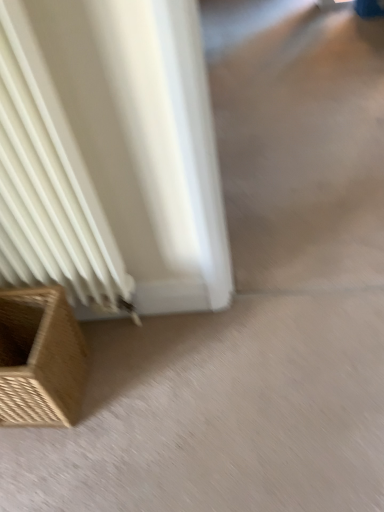
Question: Based on their positions, is brown woven basket at lower left located to the left or right of beige carpet at lower left?

Choices:
 (A) left
 (B) right

Answer: (A)

Question: Based on their sizes in the image, would you say brown woven basket at lower left is bigger or smaller than beige carpet at lower left?

Choices:
 (A) big
 (B) small

Answer: (A)

Question: From a real-world perspective, relative to beige carpet at lower left, is brown woven basket at lower left vertically above or below?

Choices:
 (A) above
 (B) below

Answer: (A)

Question: In the image, is beige carpet at lower left positioned in front of or behind brown woven basket at lower left?

Choices:
 (A) front
 (B) behind

Answer: (B)

Question: Is beige carpet at lower left bigger or smaller than brown woven basket at lower left?

Choices:
 (A) small
 (B) big

Answer: (A)

Question: Is point (66, 458) closer or farther from the camera than point (64, 344)?

Choices:
 (A) farther
 (B) closer

Answer: (B)

Question: From their relative heights in the image, would you say beige carpet at lower left is taller or shorter than brown woven basket at lower left?

Choices:
 (A) tall
 (B) short

Answer: (B)